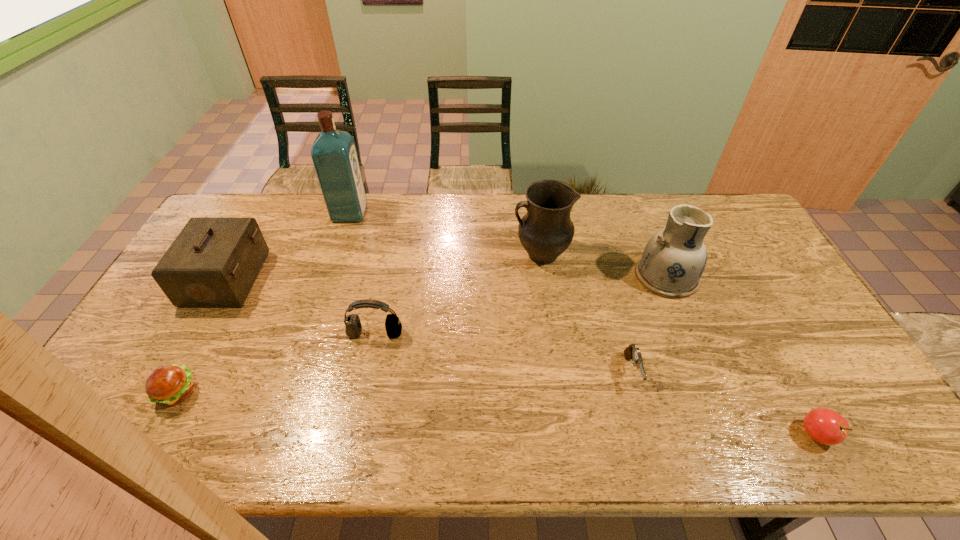
At what (x,y) coordinates should I click in order to perform the action: click on unoccupied area between the fifth object from left to right and the sixth object from right to left. Please return your answer as a coordinate pair (x, y). The width and height of the screenshot is (960, 540). Looking at the image, I should click on pos(445,234).

Find the location of a particular element. This screenshot has height=540, width=960. vacant area between the liquor and the fourth object from left to right is located at coordinates (363, 273).

Find the location of a particular element. This screenshot has width=960, height=540. vacant area that lies between the fourth tallest object and the hamburger is located at coordinates (202, 336).

The height and width of the screenshot is (540, 960). I want to click on free space that is in between the seventh object from left to right and the pistol, so click(649, 324).

Image resolution: width=960 pixels, height=540 pixels. Identify the location of free space between the pistol and the farthest object. (491, 293).

Image resolution: width=960 pixels, height=540 pixels. I want to click on vacant point located between the sixth object from left to right and the hamburger, so click(x=404, y=382).

Where is `free space between the apple and the pottery`? free space between the apple and the pottery is located at coordinates (741, 355).

Where is `empty space that is in between the liquor and the headset`? empty space that is in between the liquor and the headset is located at coordinates (363, 273).

At what (x,y) coordinates should I click in order to perform the action: click on free spot between the pottery and the pitcher. Please return your answer as a coordinate pair (x, y). The height and width of the screenshot is (540, 960). Looking at the image, I should click on (604, 266).

Locate an element on the screen. This screenshot has width=960, height=540. blank region between the farthest object and the pottery is located at coordinates (508, 245).